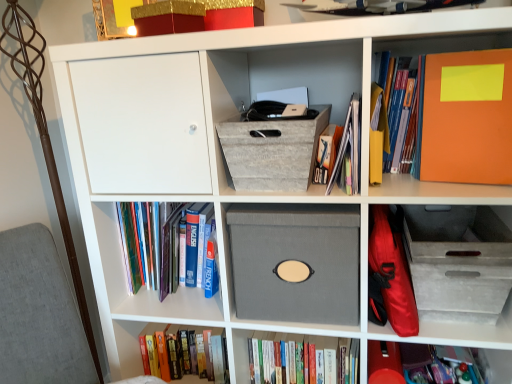
Question: Which direction should I rotate to look at hardcover book at lower center, which is the sixth book in top-to-bottom order?

Choices:
 (A) right
 (B) left

Answer: (A)

Question: Can you confirm if hardcover books at left, the 3th book in the top-to-bottom sequence, is smaller than gray fabric shoe box at center, the second shoe box in the right-to-left sequence?

Choices:
 (A) yes
 (B) no

Answer: (B)

Question: Does hardcover books at left, the fourth book positioned from the bottom, touch gray fabric shoe box at center, marked as the second shoe box in a left-to-right arrangement?

Choices:
 (A) yes
 (B) no

Answer: (B)

Question: Can gray fabric shoe box at center, marked as the second shoe box in a left-to-right arrangement, be found inside hardcover books at left, the fourth book positioned from the bottom?

Choices:
 (A) no
 (B) yes

Answer: (A)

Question: Is hardcover books at left, the fourth book positioned from the bottom, not inside gray fabric shoe box at center, marked as the second shoe box in a left-to-right arrangement?

Choices:
 (A) no
 (B) yes

Answer: (B)

Question: Does hardcover books at left, the 3th book in the top-to-bottom sequence, have a greater height compared to gray fabric shoe box at center, marked as the second shoe box in a left-to-right arrangement?

Choices:
 (A) no
 (B) yes

Answer: (A)

Question: Is hardcover books at left, the 3th book in the top-to-bottom sequence, thinner than gray fabric shoe box at center, the second shoe box in the right-to-left sequence?

Choices:
 (A) no
 (B) yes

Answer: (B)

Question: Considering the relative sizes of yellow paper at upper right, marked as the 2th paperback book in a right-to-left arrangement, and hardcover books at left, the 3th book in the top-to-bottom sequence, in the image provided, is yellow paper at upper right, marked as the 2th paperback book in a right-to-left arrangement, wider than hardcover books at left, the 3th book in the top-to-bottom sequence,?

Choices:
 (A) yes
 (B) no

Answer: (B)

Question: Can you confirm if yellow paper at upper right, marked as the 2th paperback book in a right-to-left arrangement, is shorter than hardcover books at left, the 3th book in the top-to-bottom sequence?

Choices:
 (A) yes
 (B) no

Answer: (A)

Question: Can you confirm if yellow paper at upper right, marked as the 2th paperback book in a right-to-left arrangement, is thinner than hardcover books at left, the 3th book in the top-to-bottom sequence?

Choices:
 (A) no
 (B) yes

Answer: (B)

Question: Is yellow paper at upper right, marked as the 2th paperback book in a right-to-left arrangement, smaller than hardcover books at left, the 3th book in the top-to-bottom sequence?

Choices:
 (A) yes
 (B) no

Answer: (A)

Question: Does yellow paper at upper right, marked as the 2th paperback book in a right-to-left arrangement, appear on the right side of hardcover books at left, the 3th book in the top-to-bottom sequence?

Choices:
 (A) yes
 (B) no

Answer: (A)

Question: From a real-world perspective, is yellow paper at upper right, which is the 1th paperback book from left to right, positioned over hardcover books at left, the 3th book in the top-to-bottom sequence, based on gravity?

Choices:
 (A) yes
 (B) no

Answer: (A)

Question: Can you confirm if yellow paper at upper right, marked as the 2th paperback book in a right-to-left arrangement, is positioned to the left of hardcover book at upper right, the first book viewed from the top?

Choices:
 (A) no
 (B) yes

Answer: (B)